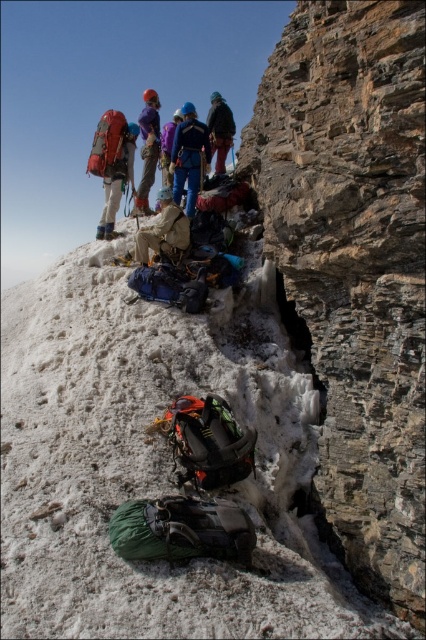
You are a climber looking at the mountain slope. You notice the matte red backpack at upper left and the beige fabric jacket at center. Which object is taller in the image?

The matte red backpack at upper left is taller than the beige fabric jacket at center.

From the picture: You are a mountaineer planning to reach the summit. You have a drone that can fly 25 meters. There is a critical point at point (112,164) that you need to survey. Can your drone reach that point?

The distance of point (112,164) from camera is 26.17 meters, so the drone cannot reach it since its maximum range is 25 meters.

You are a mountain rescue team member positioned at the base of the mountain. You need to reach the matte red backpack at upper left to retrieve an emergency kit. Based on the distance provided, is this backpack within a safe rescue range for your team?

The matte red backpack at upper left is 82.96 feet away from the camera. Since mountain rescue teams typically consider safe rescue ranges up to 100 feet, the backpack is within a safe distance for retrieval.